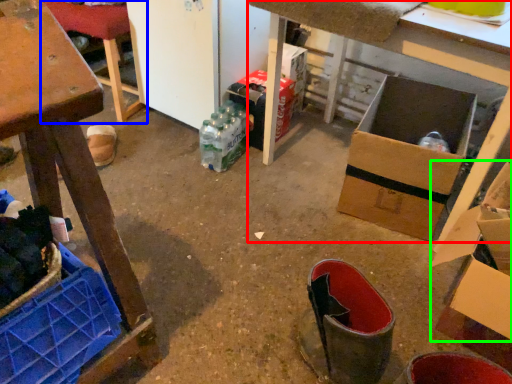
Question: Which is farther away from table (highlighted by a red box)? furniture (highlighted by a blue box) or cardboard box (highlighted by a green box)?

Choices:
 (A) furniture
 (B) cardboard box

Answer: (A)